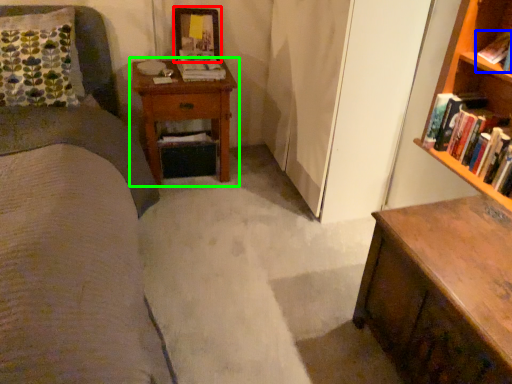
Question: Considering the real-world distances, which object is farthest from picture frame (highlighted by a red box)? book (highlighted by a blue box) or nightstand (highlighted by a green box)?

Choices:
 (A) book
 (B) nightstand

Answer: (A)